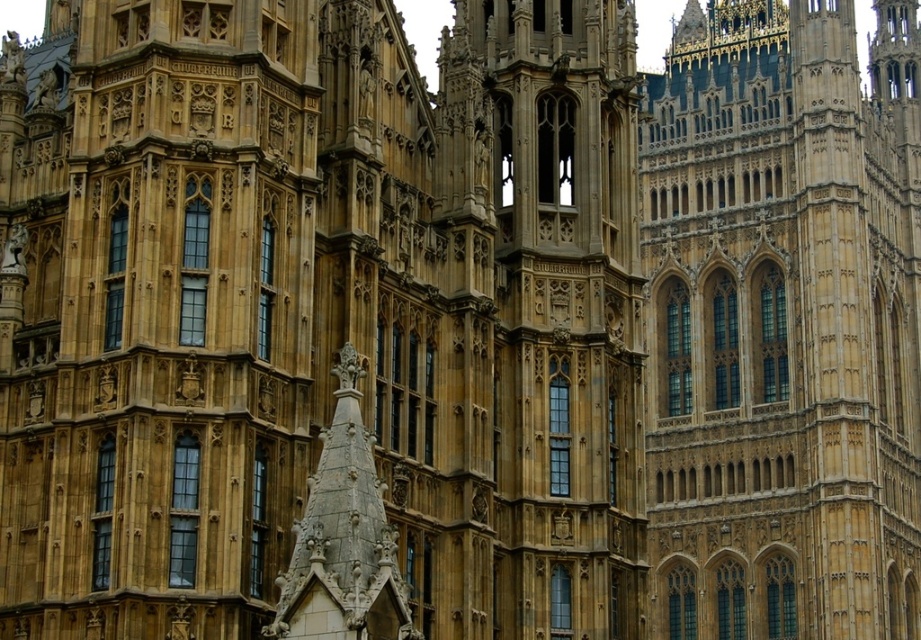
You are an architect planning to install a new decorative element between the golden stone tower at upper right and the golden stone tower at center. The element requires a minimum of 150 feet of space between the two towers. Based on the provided information, will there be sufficient space for the installation?

The golden stone tower at upper right and the golden stone tower at center are 157.92 feet apart, which exceeds the required 150 feet. Therefore, there is sufficient space for the installation.

You are standing at the base of the Palace of Westminster, admiring its architecture. You notice the golden stone tower at upper right. If you want to take a photo of it from your current position, will you be able to capture the entire tower in a single frame without moving closer or farther away?

The golden stone tower at upper right is 106.00 meters away from the viewer. Whether you can capture the entire tower in a single frame depends on your camera lens. A standard lens might require moving closer, but a wide angle lens could potentially capture the entire tower from that distance.

You are an architect analyzing the Palace of Westminster facade. You observe two golden stone towers in the image. Which tower, the golden stone tower at upper right or the golden stone tower at center, has a greater height?

The golden stone tower at upper right is taller than the golden stone tower at center.